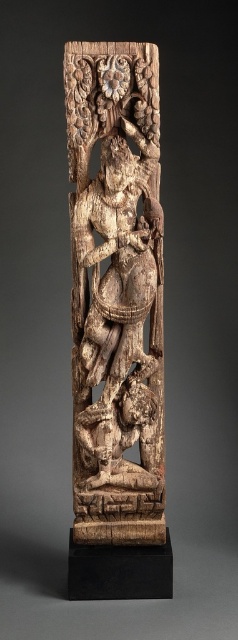
You are an art conservator examining the wooden panel. You notice two points of interest marked at coordinates point (142, 68) and point (138, 467). Which point is closer to you when you are looking at the panel?

Point (142, 68) is closer to the viewer than point (138, 467).

You are an art conservator examining the wooden panel. You need to clean the carved wood sculpture at center and the carved wood figure at lower center. Which object should you clean first if you want to start with the one that is closer to you?

You should clean the carved wood sculpture at center first because it is closer to the viewer than the carved wood figure at lower center.

Consider the image. You are an art conservator assessing the spacing between two carved wood pieces on a panel. The pieces are the carved wood sculpture at center and the carved wood figure at lower center. Given that the sculpture is wider than the figure, can you determine which one requires more horizontal space for preservation?

The carved wood sculpture at center requires more horizontal space for preservation since its width is larger than the carved wood figure at lower center.